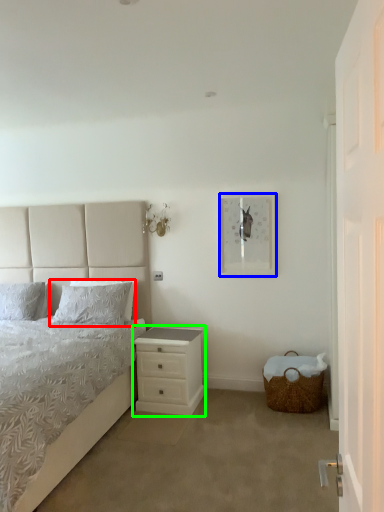
Question: Which object is the farthest from pillow (highlighted by a red box)? Choose among these: picture frame (highlighted by a blue box) or nightstand (highlighted by a green box).

Choices:
 (A) picture frame
 (B) nightstand

Answer: (A)